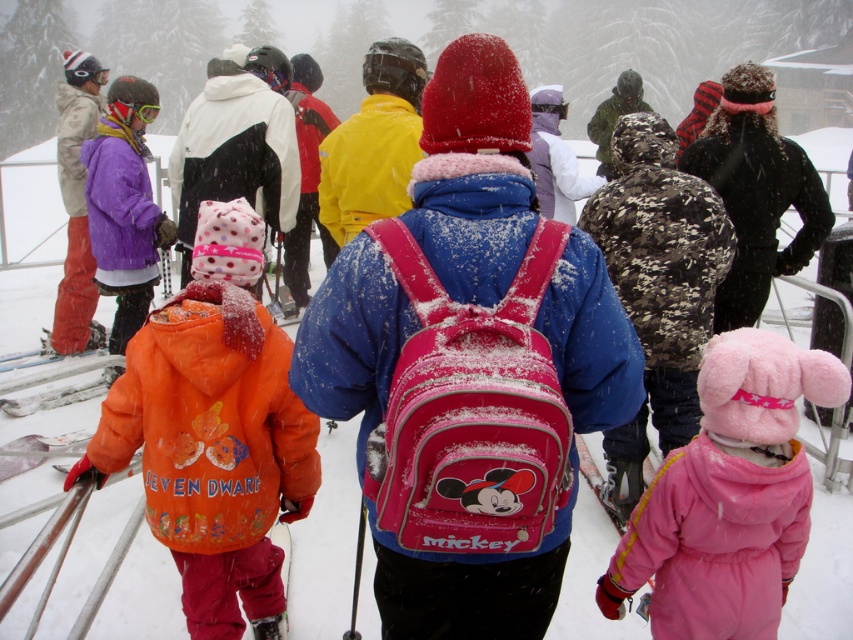
In the scene shown: You are a photographer standing at the center of the scene. You want to take a photo that includes both the orange fleece jacket at center and the purple fleece jacket at left. What is the minimum distance you need to move backward to ensure both are in frame?

The orange fleece jacket at center and purple fleece jacket at left are 8.10 feet apart. To include both in the frame, you need to move backward until the camera can capture a field of view that spans at least 8.10 feet between them. The exact distance depends on the camera lens, but generally, moving back several feet should work.